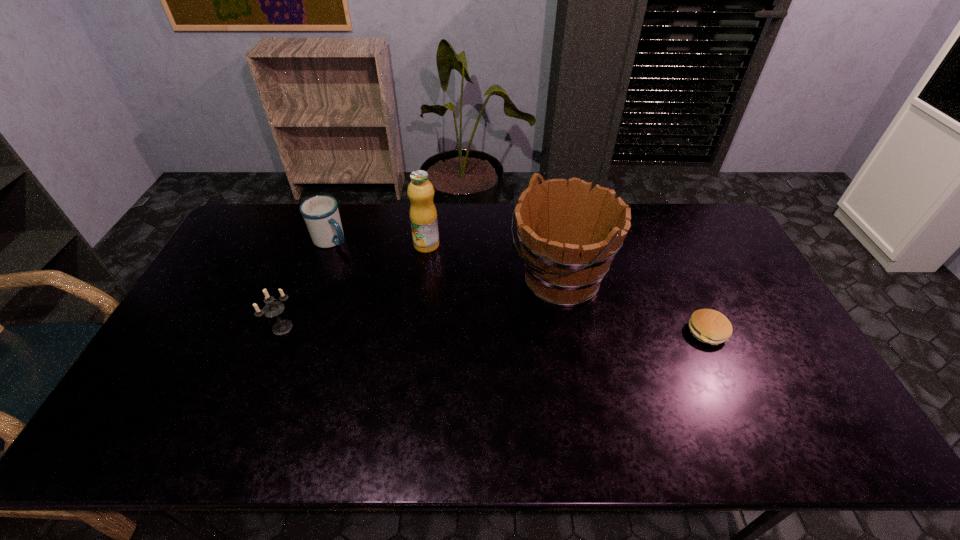
Identify the location of candle holder. The width and height of the screenshot is (960, 540). (272, 309).

Where is `patty`? patty is located at coordinates (709, 326).

Where is `the shortest object`? the shortest object is located at coordinates (709, 326).

You are a GUI agent. You are given a task and a screenshot of the screen. Output one action in this format:
    pyautogui.click(x=<x>, y=<y>)
    Task: Click on the third object from right to left
    Image resolution: width=960 pixels, height=540 pixels.
    Given the screenshot: What is the action you would take?
    pyautogui.click(x=423, y=216)

The width and height of the screenshot is (960, 540). Find the location of `the second object from right to left`. the second object from right to left is located at coordinates (569, 234).

Locate an element on the screen. This screenshot has width=960, height=540. mug is located at coordinates (321, 214).

Where is `vacant space located on the right of the candle holder`? This screenshot has width=960, height=540. vacant space located on the right of the candle holder is located at coordinates (435, 327).

This screenshot has height=540, width=960. Find the location of `free space located 0.180m on the back of the shortest object`. free space located 0.180m on the back of the shortest object is located at coordinates (681, 274).

Identify the location of free space located 0.090m on the front label of the fruit juice. This screenshot has width=960, height=540. (428, 272).

At what (x,y) coordinates should I click in order to perform the action: click on free space located on the front label of the fruit juice. Please return your answer as a coordinate pair (x, y). This screenshot has height=540, width=960. Looking at the image, I should click on (428, 272).